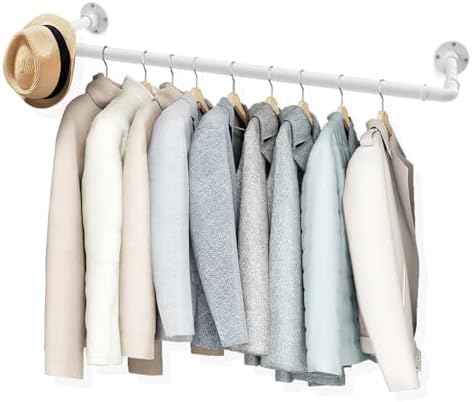
I want to click on coat, so (70, 133), (106, 140), (135, 157), (167, 170), (211, 186), (256, 202), (287, 211), (322, 217), (363, 223).